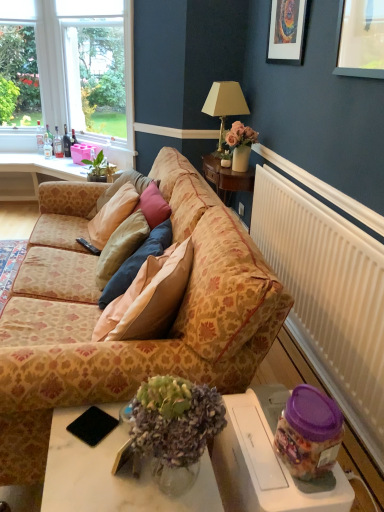
Identify the location of free spot above white marble table at lower center (from a real-world perspective). This screenshot has height=512, width=384. (109, 458).